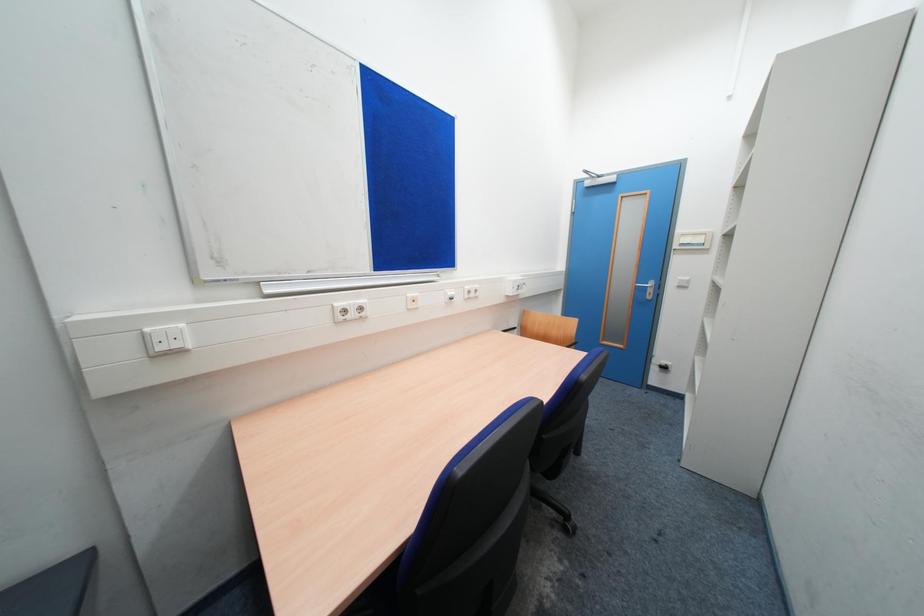
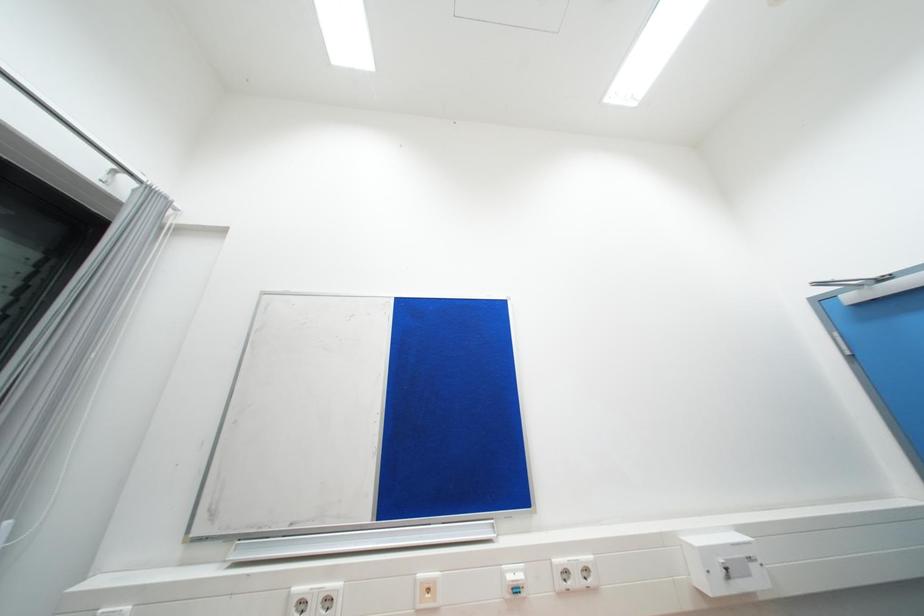
Based on the continuous images, in which direction is the camera rotating?

The camera's rotation is toward left-up.